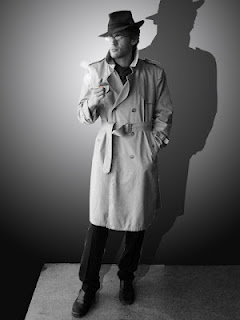
At what (x,y) coordinates should I click in order to perform the action: click on wall. Please return your answer as a coordinate pair (x, y). This screenshot has height=320, width=240. Looking at the image, I should click on (236, 112).